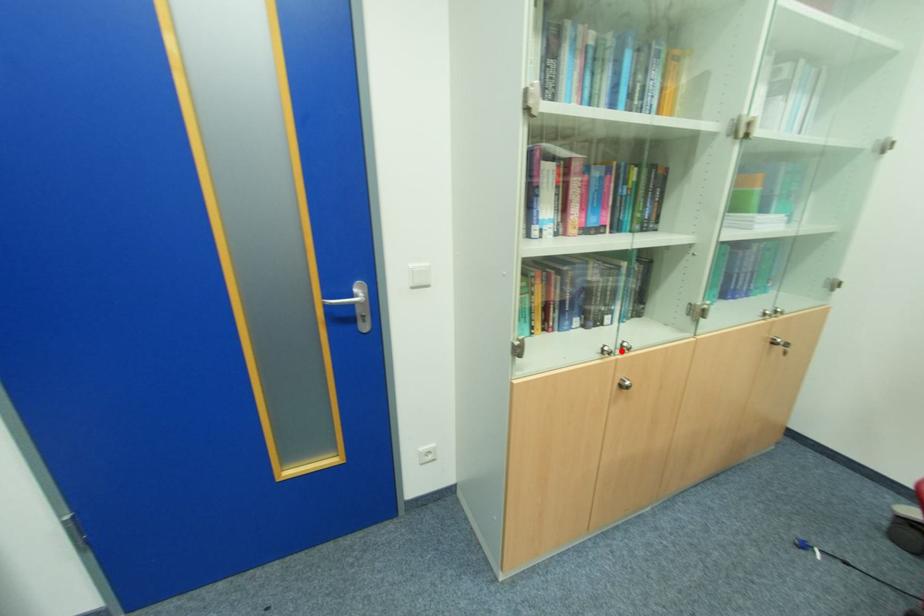
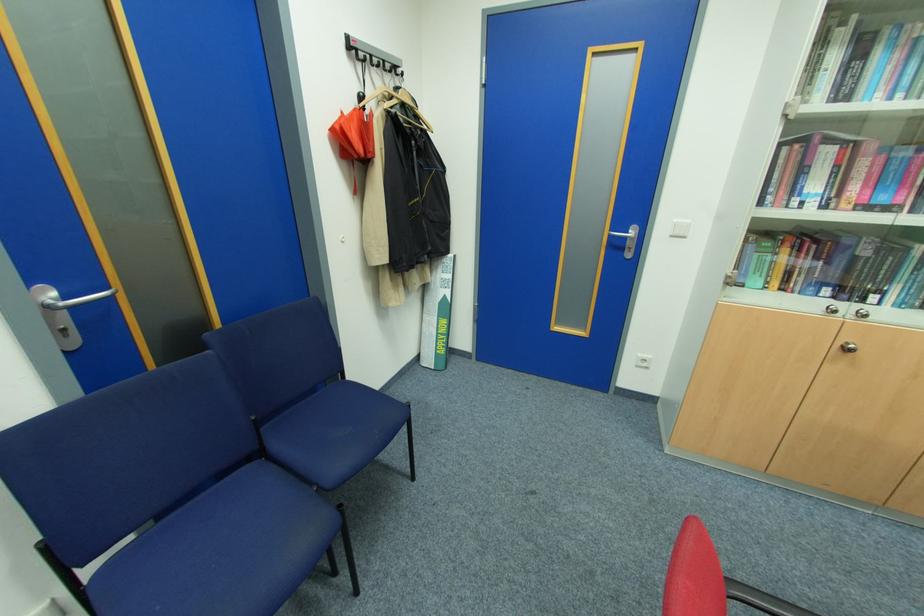
Locate, in the second image, the point that corresponds to the highlighted location in the first image.

(855, 315)